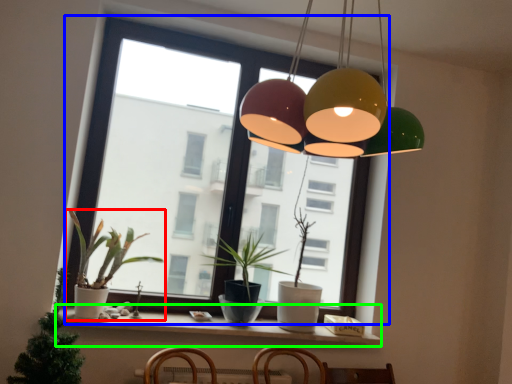
Question: Which is farther away from houseplant (highlighted by a red box)? window (highlighted by a blue box) or window sill (highlighted by a green box)?

Choices:
 (A) window
 (B) window sill

Answer: (A)